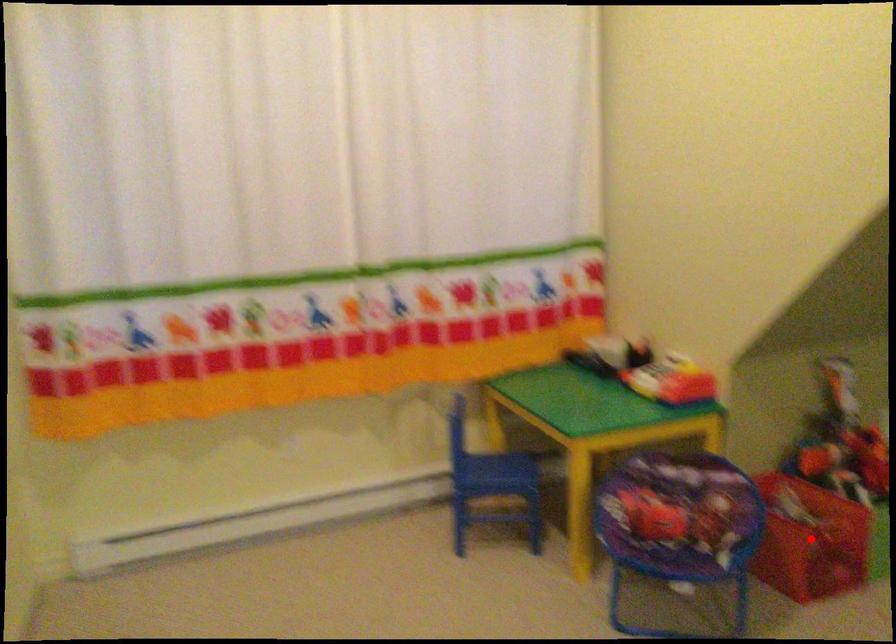
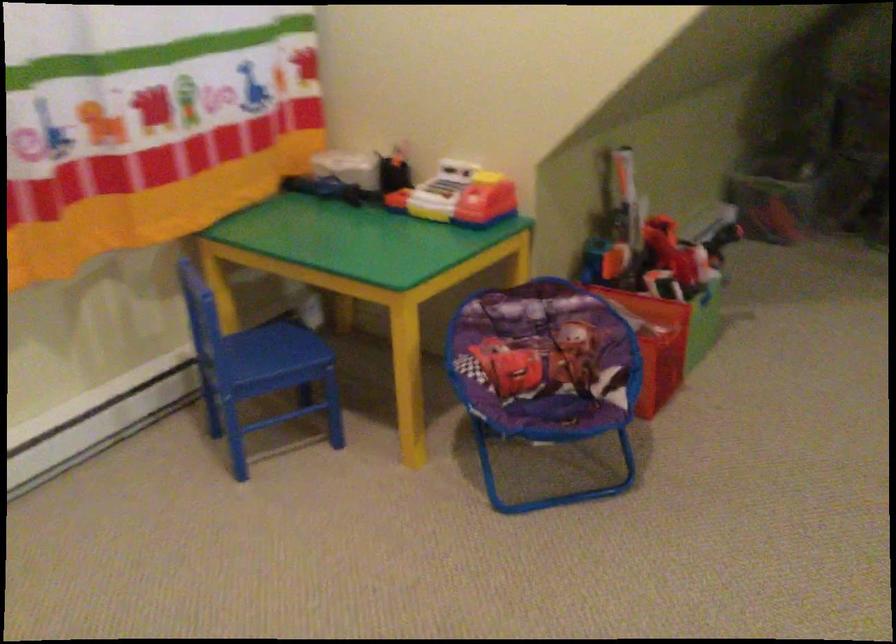
Question: I am providing you with two images of the same scene from different viewpoints. A red point is marked on the first image. Can you still see the location of the red point in image 2?

Choices:
 (A) Yes
 (B) No

Answer: (A)